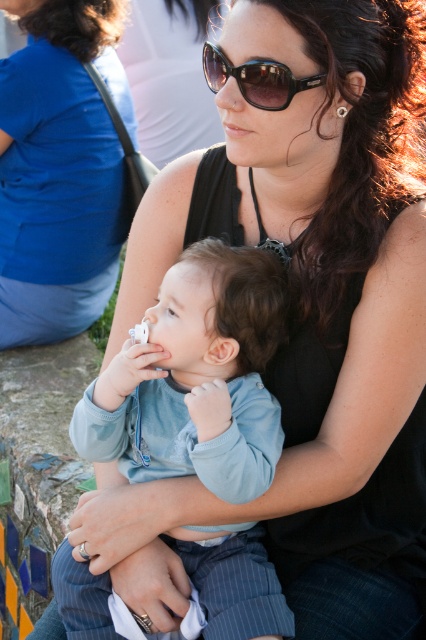
Question: Is matte black tank top at center positioned in front of brown glossy sunglasses at upper center?

Choices:
 (A) no
 (B) yes

Answer: (A)

Question: Which of the following is the farthest from the observer?

Choices:
 (A) light blue fabric pacifier at center
 (B) matte black tank top at center
 (C) brown glossy sunglasses at upper center

Answer: (B)

Question: Is light blue fabric pacifier at center bigger than brown glossy sunglasses at upper center?

Choices:
 (A) no
 (B) yes

Answer: (B)

Question: Which of the following is the closest to the observer?

Choices:
 (A) brown glossy sunglasses at upper center
 (B) light blue fabric pacifier at center

Answer: (A)

Question: Considering the relative positions of light blue fabric pacifier at center and matte black tank top at center in the image provided, where is light blue fabric pacifier at center located with respect to matte black tank top at center?

Choices:
 (A) left
 (B) right

Answer: (B)

Question: Which point appears farthest from the camera in this image?

Choices:
 (A) (46, 218)
 (B) (203, 598)

Answer: (A)